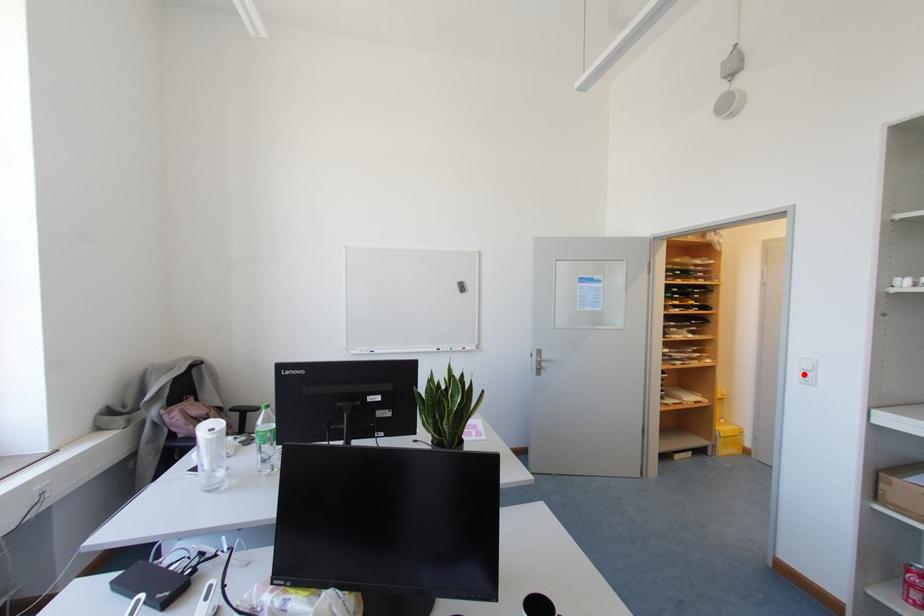
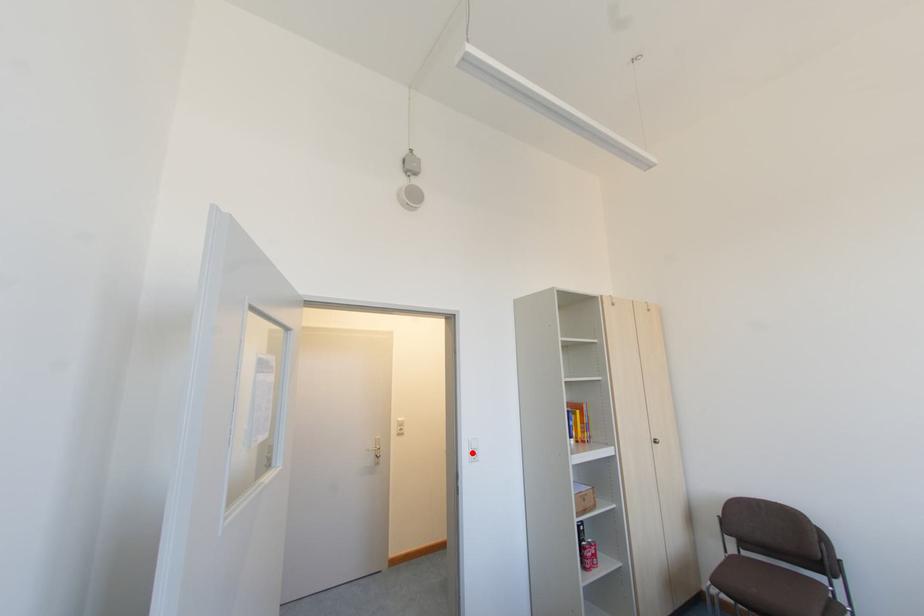
I am providing you with two images of the same scene from different viewpoints. A red point is marked on the first image and another point is marked on the second image. Are the points marked in image1 and image2 representing the same 3D position?

Yes